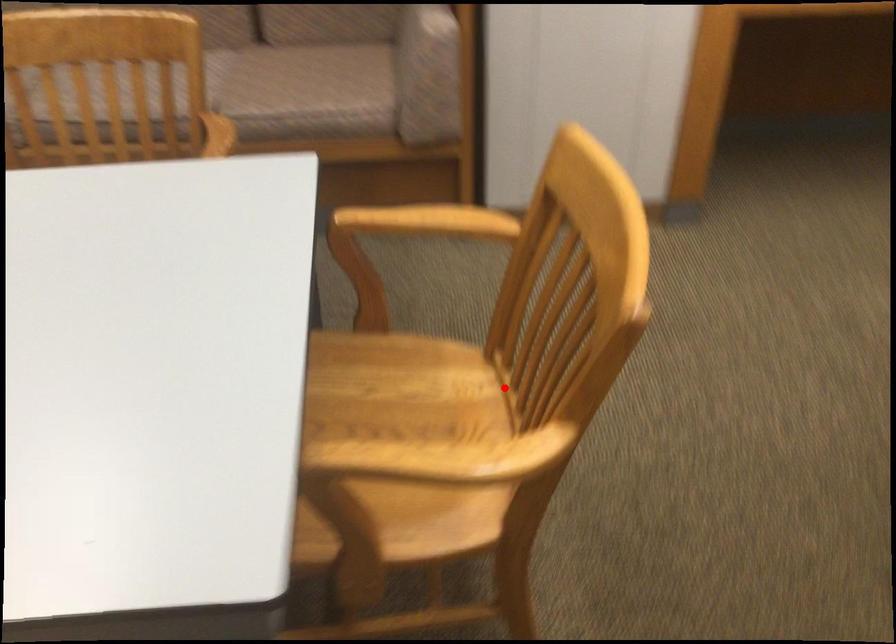
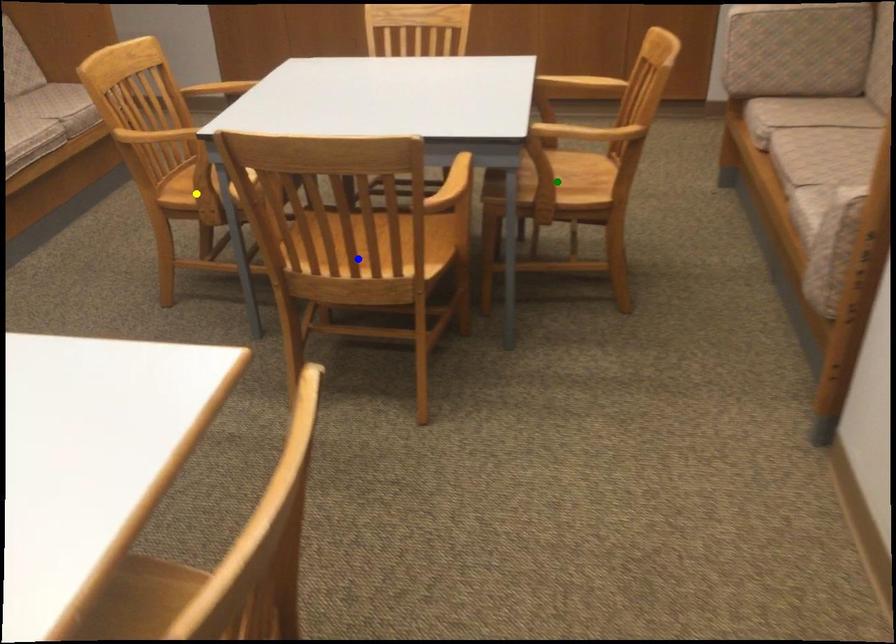
Question: I am providing you with two images of the same scene from different viewpoints. A red point is marked on the first image. You are given multiple points on the second image. In image 2, which mark is for the same physical point as the one in image 1?

Choices:
 (A) yellow point
 (B) blue point
 (C) green point

Answer: (B)